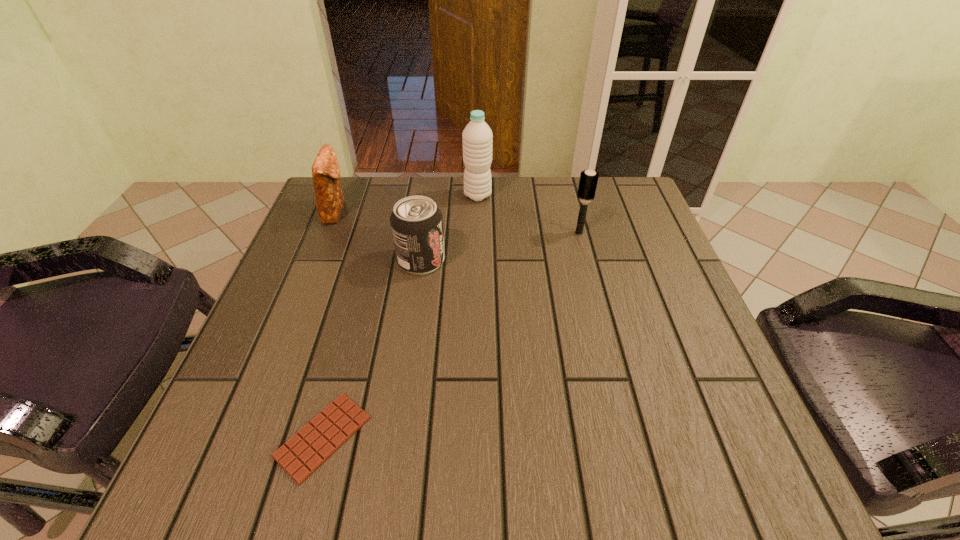
Find the location of a particular element. free space that satisfies the following two spatial constraints: 1. on the open side of the hairbrush; 2. on the right side of the clutch bag is located at coordinates (327, 233).

Locate an element on the screen. This screenshot has width=960, height=540. free space that satisfies the following two spatial constraints: 1. on the back side of the candy bar; 2. on the open side of the clutch bag is located at coordinates (384, 211).

Locate an element on the screen. This screenshot has height=540, width=960. free location that satisfies the following two spatial constraints: 1. on the back side of the rightmost object; 2. on the left side of the soda can is located at coordinates (425, 233).

At what (x,y) coordinates should I click in order to perform the action: click on vacant space that satisfies the following two spatial constraints: 1. on the back side of the candy bar; 2. on the open side of the clutch bag. Please return your answer as a coordinate pair (x, y). Looking at the image, I should click on (384, 211).

You are a GUI agent. You are given a task and a screenshot of the screen. Output one action in this format:
    pyautogui.click(x=<x>, y=<y>)
    Task: Click on the free point that satisfies the following two spatial constraints: 1. on the back side of the water bottle; 2. on the left side of the second nearest object
    Image resolution: width=960 pixels, height=540 pixels.
    Given the screenshot: What is the action you would take?
    point(431,196)